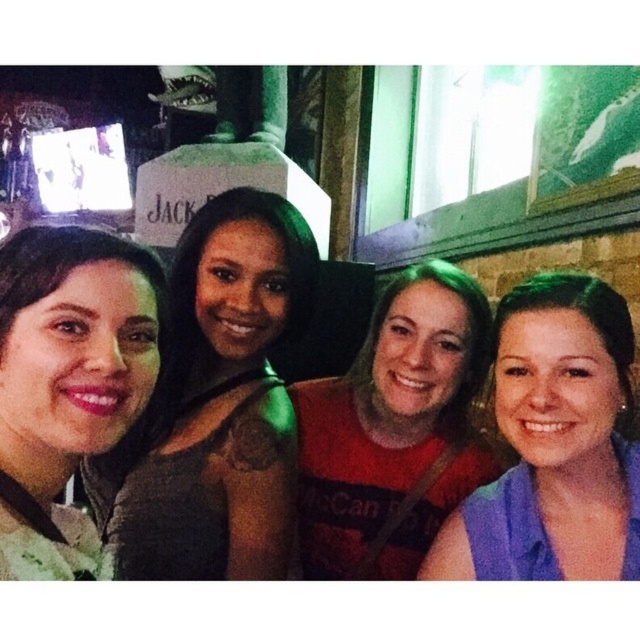
Who is more forward, (310,273) or (512,484)?

Point (512,484) is in front.

Can you confirm if matte black dress at left is bigger than blue fabric shirt at right?

Yes, matte black dress at left is bigger than blue fabric shirt at right.

The height and width of the screenshot is (640, 640). In order to click on matte black dress at left in this screenshot , I will do `click(216, 404)`.

Who is lower down, red matte shirt at center or matte gray sweater at left?

red matte shirt at center is below.

Consider the image. Is red matte shirt at center thinner than matte gray sweater at left?

No, red matte shirt at center is not thinner than matte gray sweater at left.

Is point (435, 509) behind point (12, 577)?

Yes.

This screenshot has width=640, height=640. What are the coordinates of `red matte shirt at center` in the screenshot? It's located at 394,429.

Between matte black dress at left and matte gray sweater at left, which one is positioned higher?

matte black dress at left is higher up.

Who is taller, matte black dress at left or matte gray sweater at left?

With more height is matte black dress at left.

Does point (129, 433) come in front of point (26, 536)?

No.

The height and width of the screenshot is (640, 640). In order to click on matte black dress at left in this screenshot , I will do `click(216, 404)`.